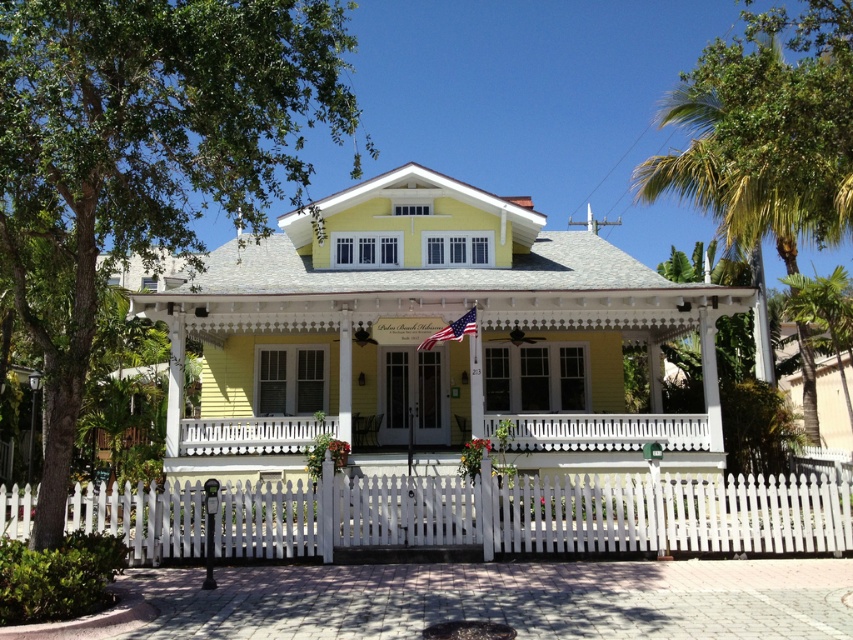
Question: Considering the relative positions of green leafy palm tree at upper right and green leafy palm tree at right in the image provided, where is green leafy palm tree at upper right located with respect to green leafy palm tree at right?

Choices:
 (A) above
 (B) below

Answer: (A)

Question: Can you confirm if white picket fence at center is positioned above green leafy palm tree at right?

Choices:
 (A) yes
 (B) no

Answer: (B)

Question: Which of the following is the farthest from the observer?

Choices:
 (A) (456, 326)
 (B) (201, 445)
 (C) (740, 218)

Answer: (C)

Question: Can you confirm if white picket fence at center is wider than white wooden porch at center?

Choices:
 (A) no
 (B) yes

Answer: (B)

Question: Which of the following is the closest to the observer?

Choices:
 (A) american flag at center
 (B) green leafy palm tree at upper right
 (C) green leafy palm tree at right

Answer: (B)

Question: Which point is farther from the camera taking this photo?

Choices:
 (A) (273, 451)
 (B) (845, 396)

Answer: (B)